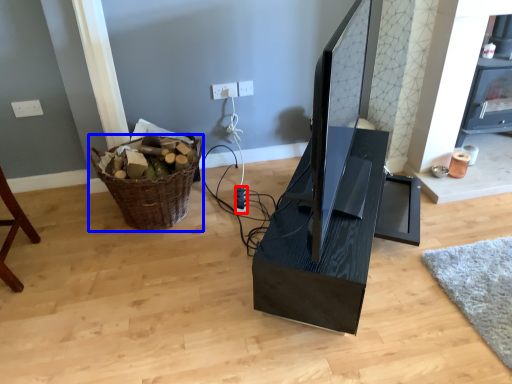
Question: Which of the following is the farthest to the observer, plug (highlighted by a red box) or basket (highlighted by a blue box)?

Choices:
 (A) plug
 (B) basket

Answer: (A)